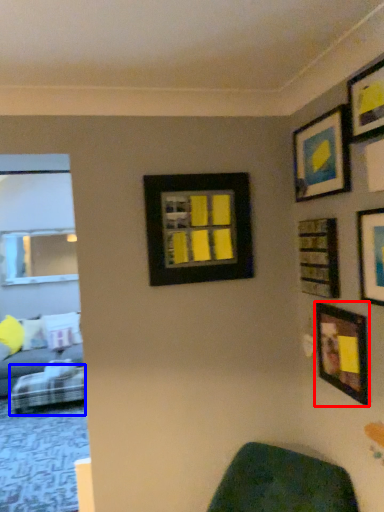
Question: Which object is further to the camera taking this photo, picture frame (highlighted by a red box) or furniture (highlighted by a blue box)?

Choices:
 (A) picture frame
 (B) furniture

Answer: (B)